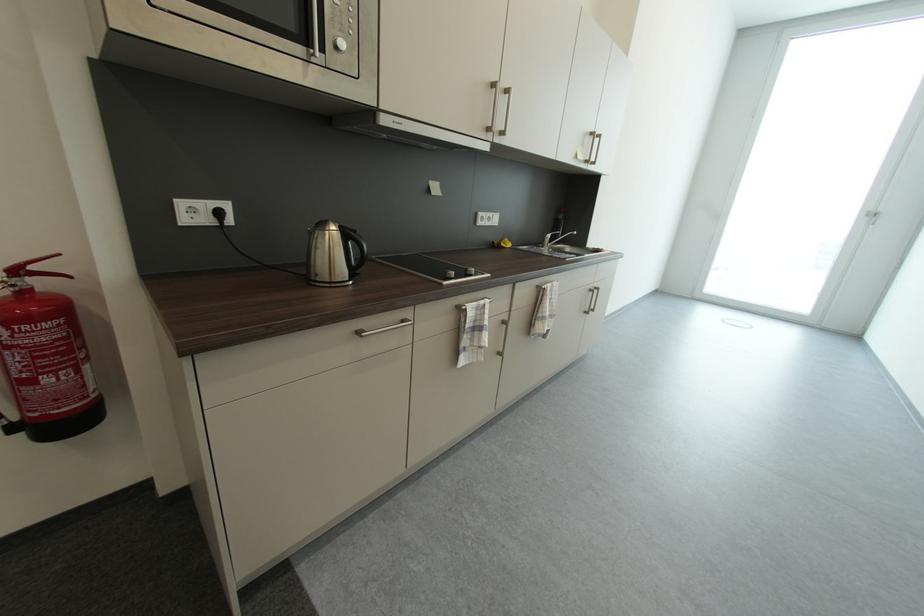
The image size is (924, 616). I want to click on kettle handle, so click(x=355, y=243).